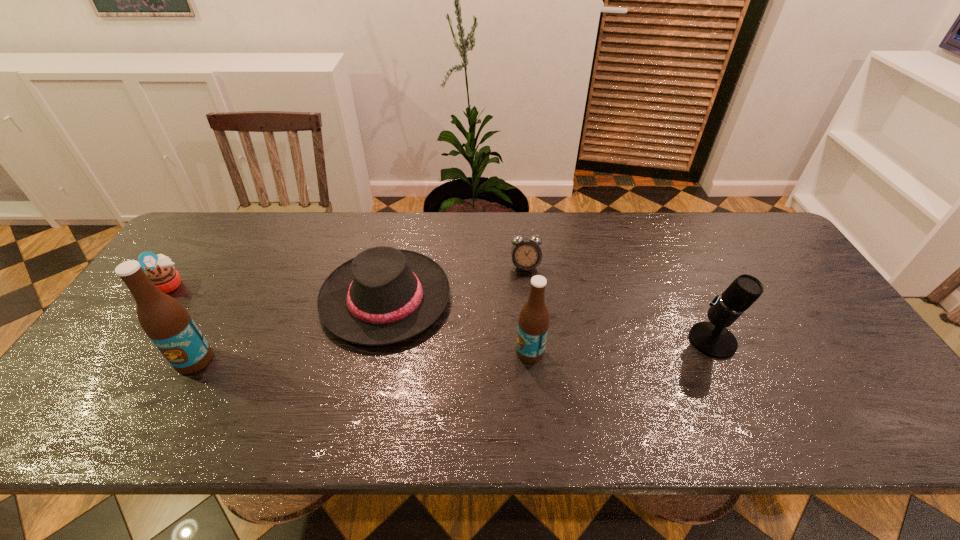
Please point a vacant point for placing a beer bottle on the right. Please provide its 2D coordinates. Your answer should be formatted as a tuple, i.e. [(x, y)], where the tuple contains the x and y coordinates of a point satisfying the conditions above.

[(855, 343)]